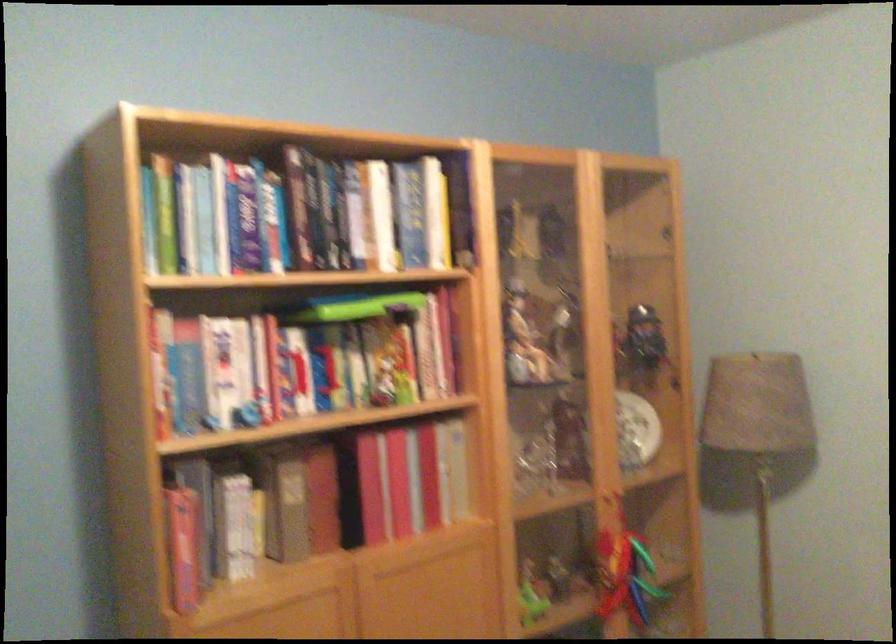
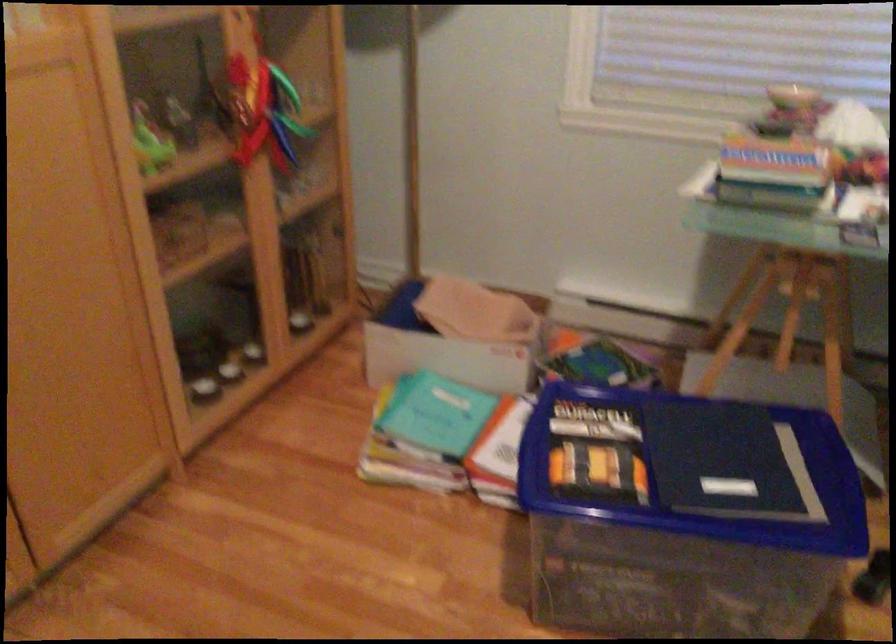
First-person continuous shooting, in which direction is the camera rotating?

The rotation direction of the camera is right-down.